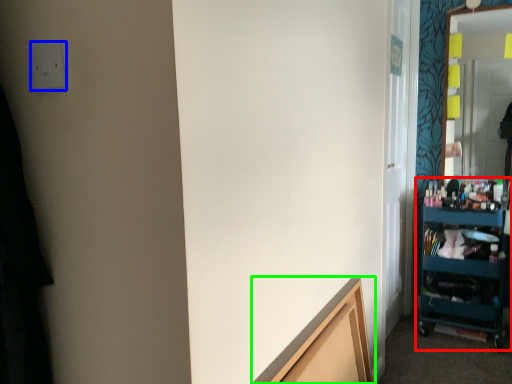
Question: Which is farther away from shelf (highlighted by a red box)? electric outlet (highlighted by a blue box) or cabinetry (highlighted by a green box)?

Choices:
 (A) electric outlet
 (B) cabinetry

Answer: (A)